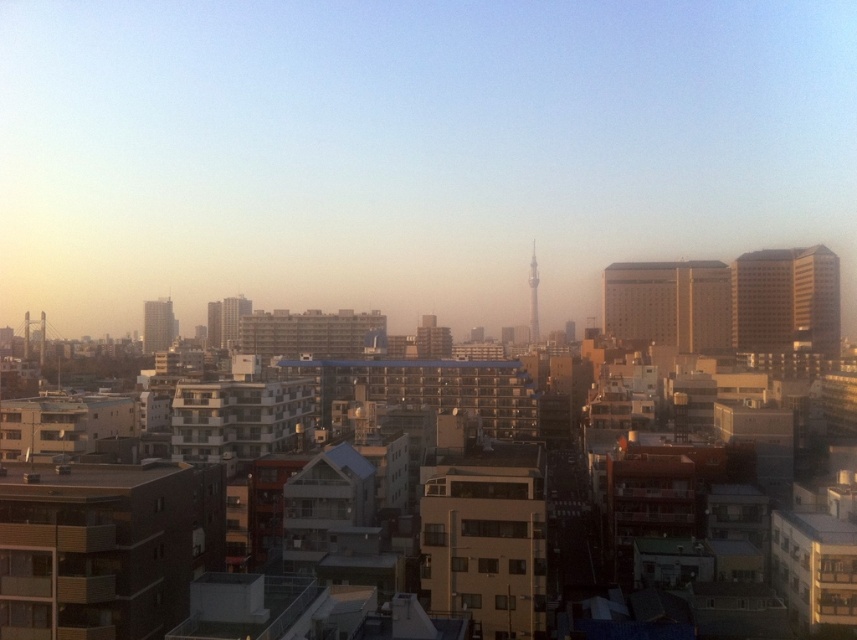
Does beige concrete building at right have a smaller size compared to matte gray building at left?

Actually, beige concrete building at right might be larger than matte gray building at left.

Image resolution: width=857 pixels, height=640 pixels. I want to click on beige concrete building at right, so click(784, 300).

Who is positioned more to the left, matte gray building at left or smooth glass tower at center?

matte gray building at left

Can you confirm if matte gray building at left is smaller than smooth glass tower at center?

No, matte gray building at left is not smaller than smooth glass tower at center.

Who is more forward, (163, 324) or (532, 332)?

Positioned in front is point (163, 324).

At what (x,y) coordinates should I click in order to perform the action: click on matte gray building at left. Please return your answer as a coordinate pair (x, y). This screenshot has height=640, width=857. Looking at the image, I should click on (159, 324).

Does beige concrete building at right have a smaller size compared to brown textured building at center?

Yes.

Consider the image. Does beige concrete building at right have a lesser width compared to brown textured building at center?

Yes.

Where is `beige concrete building at right`? beige concrete building at right is located at coordinates (784, 300).

You are a GUI agent. You are given a task and a screenshot of the screen. Output one action in this format:
    pyautogui.click(x=<x>, y=<y>)
    Task: Click on the beige concrete building at right
    Image resolution: width=857 pixels, height=640 pixels.
    Given the screenshot: What is the action you would take?
    pyautogui.click(x=784, y=300)